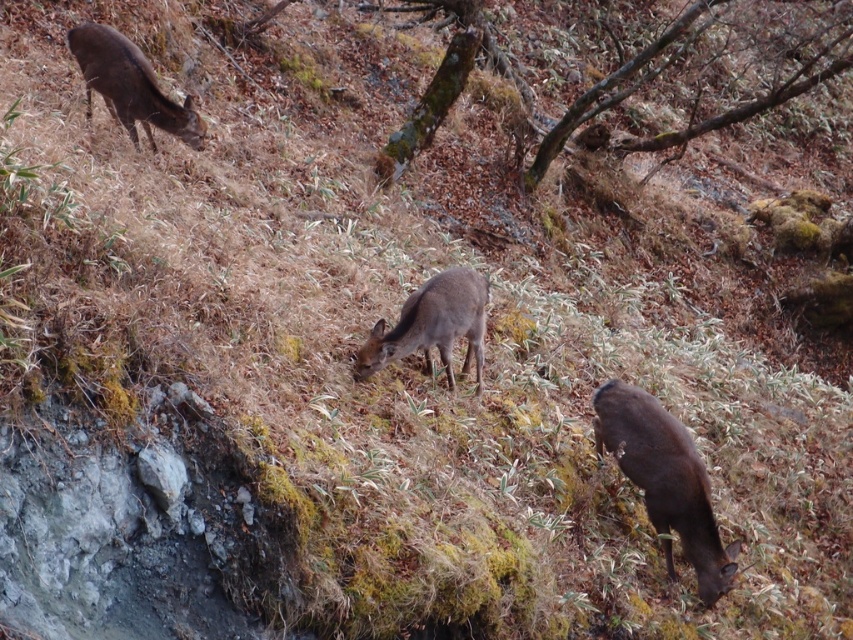
You are standing on the hillside and want to move from the point at coordinates point (459, 275) to the point at coordinates point (200, 129). Which direction should you face to walk towards the second point?

You should face towards the upper left direction because point (200, 129) is further away from the viewer compared to point (459, 275), which means it is located higher up on the slope.

You are a hiker standing at the bottom of the hillside. You see the brown matte deer at lower right and the brown matte deer at upper left. Which deer is closer to you?

The brown matte deer at lower right is closer to you because it is positioned in the lower part of the hillside, which is nearer to the bottom where you are standing, whereas the brown matte deer at upper left is further up the slope and thus farther away.